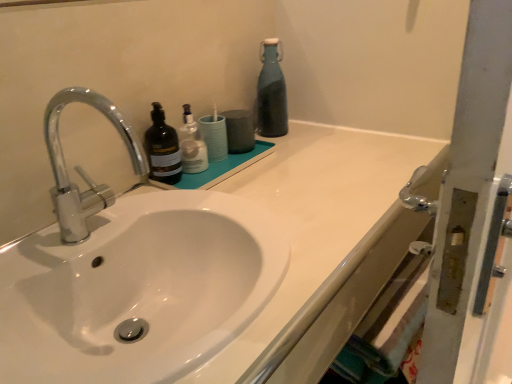
Where is `white glossy sink at center`? This screenshot has width=512, height=384. white glossy sink at center is located at coordinates (131, 275).

Considering the positions of objects translucent plastic bottle at center, the second bottle viewed from the left, and teal glass bottle at upper right, which is the 3th bottle from front to back, in the image provided, who is more to the left, translucent plastic bottle at center, the second bottle viewed from the left, or teal glass bottle at upper right, which is the 3th bottle from front to back,?

translucent plastic bottle at center, the second bottle viewed from the left.

From the image's perspective, is translucent plastic bottle at center, the 2th bottle viewed from the front, positioned above or below teal glass bottle at upper right, which is counted as the third bottle, starting from the left?

Based on their image positions, translucent plastic bottle at center, the 2th bottle viewed from the front, is located beneath teal glass bottle at upper right, which is counted as the third bottle, starting from the left.

The height and width of the screenshot is (384, 512). In order to click on the 2nd bottle positioned below the teal glass bottle at upper right, the 1th bottle positioned from the back (from a real-world perspective) in this screenshot , I will do `click(192, 145)`.

From a real-world perspective, is polished chrome faucet at left under translucent plastic bottle at center, marked as the 2th bottle in a right-to-left arrangement?

No.

Does polished chrome faucet at left have a lesser width compared to translucent plastic bottle at center, marked as the 2th bottle in a right-to-left arrangement?

Incorrect, the width of polished chrome faucet at left is not less than that of translucent plastic bottle at center, marked as the 2th bottle in a right-to-left arrangement.

In the image, is polished chrome faucet at left on the left side or the right side of translucent plastic bottle at center, the second bottle viewed from the left?

From the image, it's evident that polished chrome faucet at left is to the left of translucent plastic bottle at center, the second bottle viewed from the left.

Who is shorter, polished chrome faucet at left or matte black bottle at center, marked as the third bottle in a right-to-left arrangement?

Standing shorter between the two is matte black bottle at center, marked as the third bottle in a right-to-left arrangement.

Is polished chrome faucet at left facing away from matte black bottle at center, which appears as the 3th bottle when viewed from the back?

No, polished chrome faucet at left is not facing away from matte black bottle at center, which appears as the 3th bottle when viewed from the back.

Where is `bottle that is the 1st object to the right of the polished chrome faucet at left, starting at the anchor`? The height and width of the screenshot is (384, 512). bottle that is the 1st object to the right of the polished chrome faucet at left, starting at the anchor is located at coordinates (162, 149).

Is white glossy bottle at upper center oriented towards white glossy sink at center?

No, white glossy bottle at upper center is not facing towards white glossy sink at center.

In terms of width, does white glossy bottle at upper center look wider or thinner when compared to white glossy sink at center?

In the image, white glossy bottle at upper center appears to be more narrow than white glossy sink at center.

Is white glossy bottle at upper center spatially inside white glossy sink at center, or outside of it?

white glossy bottle at upper center exists outside the volume of white glossy sink at center.

From a real-world perspective, starting from the polished chrome faucet at left, which bottle is the 1st one below it? Please provide its 2D coordinates.

[(162, 149)]

Does point (155, 135) appear closer or farther from the camera than point (93, 103)?

Point (155, 135) is positioned farther from the camera compared to point (93, 103).

In terms of height, does matte black bottle at center, marked as the third bottle in a right-to-left arrangement, look taller or shorter compared to polished chrome faucet at left?

Clearly, matte black bottle at center, marked as the third bottle in a right-to-left arrangement, is shorter compared to polished chrome faucet at left.

Which of these two, matte black bottle at center, which appears as the first bottle when viewed from the front, or polished chrome faucet at left, is smaller?

Smaller between the two is matte black bottle at center, which appears as the first bottle when viewed from the front.

From the image's perspective, does white glossy sink at center appear higher than polished chrome faucet at left?

No.

Can you confirm if white glossy sink at center is taller than polished chrome faucet at left?

In fact, white glossy sink at center may be shorter than polished chrome faucet at left.

Considering the relative positions of white glossy sink at center and polished chrome faucet at left in the image provided, is white glossy sink at center to the left or to the right of polished chrome faucet at left?

white glossy sink at center is positioned on polished chrome faucet at left's right side.

From the image's perspective, is white glossy bottle at upper center beneath matte black bottle at center, which appears as the 3th bottle when viewed from the back?

No.

In the image, there is a matte black bottle at center, marked as the third bottle in a right-to-left arrangement. Find the location of `toiletry below it (from a real-world perspective)`. toiletry below it (from a real-world perspective) is located at coordinates (214, 136).

Is white glossy bottle at upper center to the right of matte black bottle at center, which appears as the first bottle when viewed from the front, from the viewer's perspective?

Indeed, white glossy bottle at upper center is positioned on the right side of matte black bottle at center, which appears as the first bottle when viewed from the front.

Would you say white glossy bottle at upper center contains matte black bottle at center, the 1th bottle when ordered from left to right?

No, matte black bottle at center, the 1th bottle when ordered from left to right, is located outside of white glossy bottle at upper center.

Locate an element on the screen. This screenshot has width=512, height=384. the 1st bottle in front of the teal glass bottle at upper right, which is the 3th bottle from front to back, counting from the anchor's position is located at coordinates (192, 145).

Which bottle is the 2nd one when counting from the back of the polished chrome faucet at left? Please provide its 2D coordinates.

[(192, 145)]

Which object lies nearer to the anchor point white glossy sink at center, translucent plastic bottle at center, the 2th bottle viewed from the front, or white glossy bottle at upper center?

translucent plastic bottle at center, the 2th bottle viewed from the front.

Based on their spatial positions, is translucent plastic bottle at center, the second bottle viewed from the left, or white glossy sink at center further from polished chrome faucet at left?

translucent plastic bottle at center, the second bottle viewed from the left, is further to polished chrome faucet at left.

Considering their positions, is white glossy sink at center positioned further to matte black bottle at center, which appears as the first bottle when viewed from the front, than metallic silver screen door at right?

Among the two, metallic silver screen door at right is located further to matte black bottle at center, which appears as the first bottle when viewed from the front.

Estimate the real-world distances between objects in this image. Which object is further from polished chrome faucet at left, white glossy sink at center or matte black bottle at center, the 1th bottle when ordered from left to right?

matte black bottle at center, the 1th bottle when ordered from left to right, is further to polished chrome faucet at left.

Estimate the real-world distances between objects in this image. Which object is further from polished chrome faucet at left, matte black bottle at center, which appears as the 3th bottle when viewed from the back, or teal glass bottle at upper right, which is counted as the third bottle, starting from the left?

teal glass bottle at upper right, which is counted as the third bottle, starting from the left, is further to polished chrome faucet at left.

From the image, which object appears to be farther from teal glass bottle at upper right, which is counted as the third bottle, starting from the left, translucent plastic bottle at center, the 2th bottle viewed from the front, or white glossy sink at center?

The object further to teal glass bottle at upper right, which is counted as the third bottle, starting from the left, is white glossy sink at center.

Considering their positions, is teal glass bottle at upper right, which is the 3th bottle from front to back, positioned further to metallic silver screen door at right than polished chrome faucet at left?

teal glass bottle at upper right, which is the 3th bottle from front to back.

Looking at the image, which one is located further to white glossy sink at center, polished chrome faucet at left or metallic silver screen door at right?

metallic silver screen door at right is positioned further to the anchor white glossy sink at center.

At what (x,y) coordinates should I click in order to perform the action: click on sink between matte black bottle at center, the 1th bottle when ordered from left to right, and metallic silver screen door at right, in the horizontal direction. Please return your answer as a coordinate pair (x, y). Image resolution: width=512 pixels, height=384 pixels. Looking at the image, I should click on (131, 275).

You are a GUI agent. You are given a task and a screenshot of the screen. Output one action in this format:
    pyautogui.click(x=<x>, y=<y>)
    Task: Click on the tap located between metallic silver screen door at right and teal glass bottle at upper right, the 1th bottle positioned from the back, in the depth direction
    This screenshot has width=512, height=384.
    Given the screenshot: What is the action you would take?
    pyautogui.click(x=81, y=168)

The height and width of the screenshot is (384, 512). Find the location of `bottle between white glossy sink at center and translucent plastic bottle at center, the 2th bottle when ordered from back to front, from front to back`. bottle between white glossy sink at center and translucent plastic bottle at center, the 2th bottle when ordered from back to front, from front to back is located at coordinates [x=162, y=149].

The image size is (512, 384). In order to click on bottle between matte black bottle at center, marked as the third bottle in a right-to-left arrangement, and white glossy bottle at upper center, along the z-axis in this screenshot , I will do `click(192, 145)`.